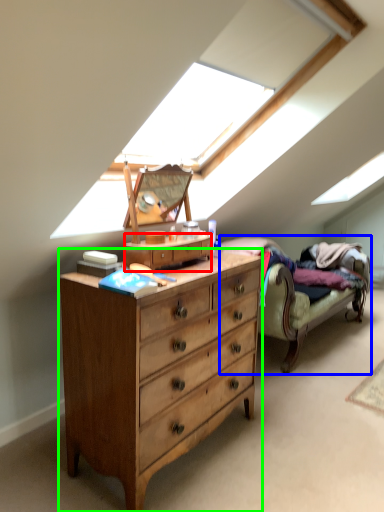
Question: Estimate the real-world distances between objects in this image. Which object is farther from file cabinet (highlighted by a red box), studio couch (highlighted by a blue box) or chest of drawers (highlighted by a green box)?

Choices:
 (A) studio couch
 (B) chest of drawers

Answer: (A)